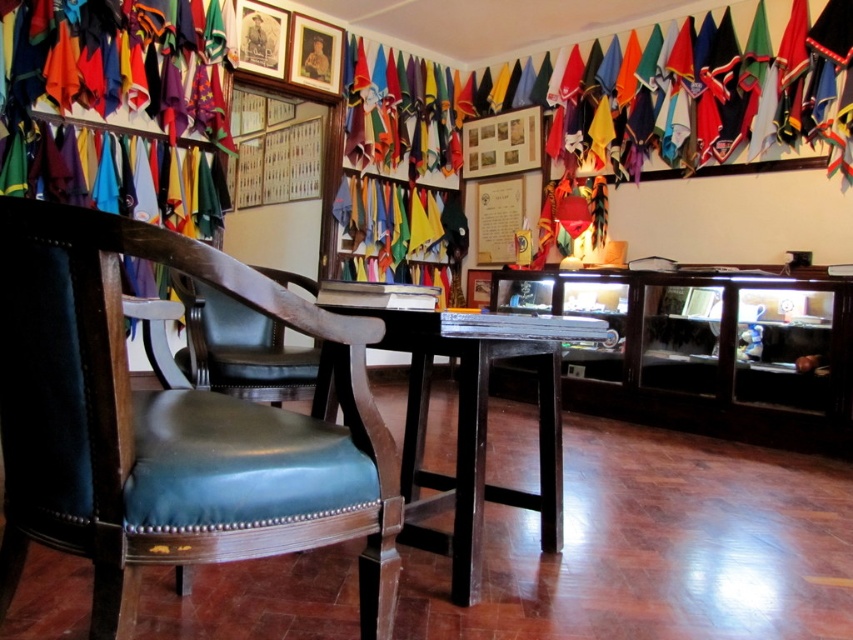
Who is taller, leather at left or leather at center?

leather at left is taller.

Is point (106, 468) in front of point (230, 301)?

Yes, point (106, 468) is closer to viewer.

Where is `leather at left`? This screenshot has width=853, height=640. leather at left is located at coordinates (172, 426).

How much distance is there between leather at left and dark wood table at center?

A distance of 14.58 inches exists between leather at left and dark wood table at center.

Does point (3, 419) come farther from viewer compared to point (345, 308)?

No, (3, 419) is closer to viewer.

Which is in front, point (381, 556) or point (473, 580)?

Point (381, 556) is in front.

Where is `leather at left`? The width and height of the screenshot is (853, 640). leather at left is located at coordinates (172, 426).

Can you confirm if dark wood table at center is smaller than leather at center?

Actually, dark wood table at center might be larger than leather at center.

What do you see at coordinates (471, 419) in the screenshot? I see `dark wood table at center` at bounding box center [471, 419].

What do you see at coordinates (471, 419) in the screenshot? The image size is (853, 640). I see `dark wood table at center` at bounding box center [471, 419].

Image resolution: width=853 pixels, height=640 pixels. I want to click on dark wood table at center, so click(x=471, y=419).